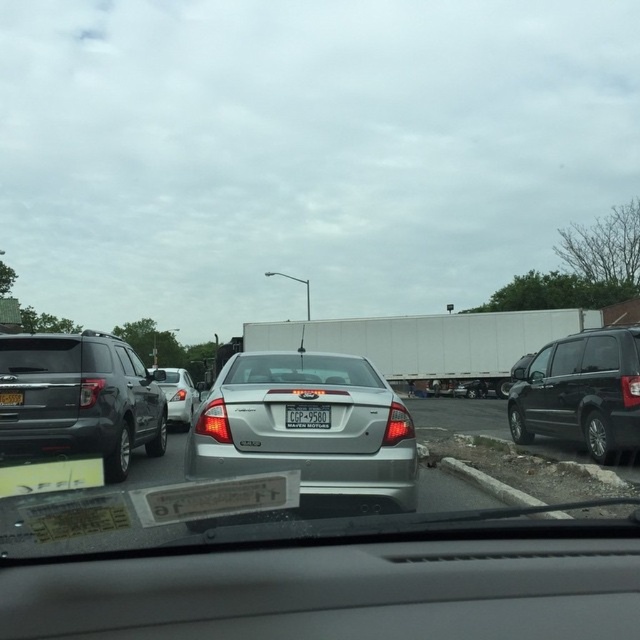
Does white matte trailer truck at center have a lesser height compared to white plastic license plate at center?

No.

Looking at this image, who is more forward, (497, 387) or (16, 390)?

Point (16, 390) is more forward.

Is point (369, 332) behind point (4, 392)?

Yes, point (369, 332) is farther from viewer.

Find the location of a particular element. The image size is (640, 640). white matte trailer truck at center is located at coordinates (429, 340).

Who is shorter, clear glass windshield at center or silver metallic sedan at center?

With less height is clear glass windshield at center.

Measure the distance between clear glass windshield at center and silver metallic sedan at center.

clear glass windshield at center is 5.91 meters away from silver metallic sedan at center.

Is point (298, 362) positioned behind point (189, 388)?

No, it is not.

Find the location of a particular element. Image resolution: width=640 pixels, height=640 pixels. clear glass windshield at center is located at coordinates (301, 369).

In the scene shown: Who is positioned more to the right, shiny black minivan at right or silver metallic sedan at center?

From the viewer's perspective, shiny black minivan at right appears more on the right side.

How distant is shiny black minivan at right from silver metallic sedan at center?

A distance of 12.92 meters exists between shiny black minivan at right and silver metallic sedan at center.

Locate an element on the screen. Image resolution: width=640 pixels, height=640 pixels. shiny black minivan at right is located at coordinates (580, 392).